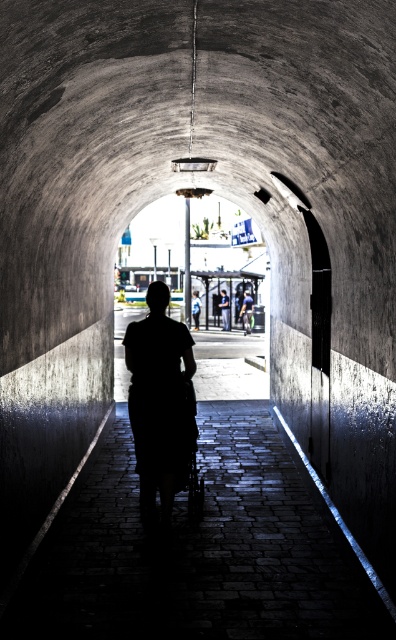
You are standing inside the tunnel and see both the silhouette dress at center and the light brown leather jacket at center. Which one is nearer to you?

The silhouette dress at center is closer to the viewer than the light brown leather jacket at center, so the silhouette dress at center is nearer to you.

Looking at this image, you are standing inside the tunnel and see both the silhouette dress at center and the green fabric shirt at center. Which one is closer to the bright light source at the end of the tunnel?

The silhouette dress at center is below the green fabric shirt at center, so the green fabric shirt at center is closer to the bright light source at the end of the tunnel.